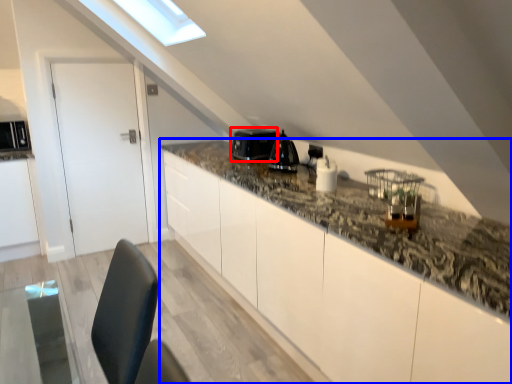
Question: Which object appears farthest to the camera in this image, appliance (highlighted by a red box) or countertop (highlighted by a blue box)?

Choices:
 (A) appliance
 (B) countertop

Answer: (A)